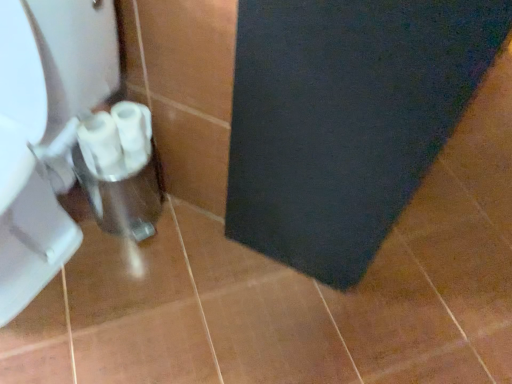
Question: In terms of height, does white glossy toilet paper at lower left, the second toilet paper in the right-to-left sequence, look taller or shorter compared to white plastic toilet paper at lower left, the 2th toilet paper in the left-to-right sequence?

Choices:
 (A) short
 (B) tall

Answer: (B)

Question: Visually, is white glossy toilet paper at lower left, the second toilet paper in the right-to-left sequence, positioned to the left or to the right of white plastic toilet paper at lower left, the 2th toilet paper in the left-to-right sequence?

Choices:
 (A) right
 (B) left

Answer: (B)

Question: Which object is positioned closest to the white plastic toilet paper at lower left, which is the 1th toilet paper in right-to-left order?

Choices:
 (A) white glossy toilet paper at lower left, the second toilet paper in the right-to-left sequence
 (B) white glossy toilet at left
 (C) dark blue felt bath mat at lower right

Answer: (A)

Question: Which is nearer to the dark blue felt bath mat at lower right?

Choices:
 (A) white glossy toilet paper at lower left, the first toilet paper when ordered from left to right
 (B) white plastic toilet paper at lower left, which is the 1th toilet paper in right-to-left order
 (C) white glossy toilet at left

Answer: (B)